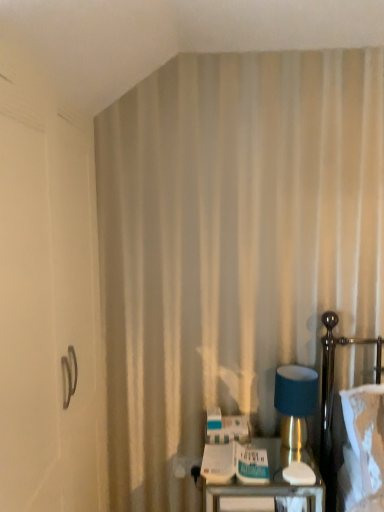
Question: From a real-world perspective, is metallic handle at left on top of matte blue fabric at right?

Choices:
 (A) yes
 (B) no

Answer: (A)

Question: From a real-world perspective, is metallic handle at left beneath matte blue fabric at right?

Choices:
 (A) yes
 (B) no

Answer: (B)

Question: Is metallic handle at left bigger than matte blue fabric at right?

Choices:
 (A) no
 (B) yes

Answer: (B)

Question: Is metallic handle at left thinner than matte blue fabric at right?

Choices:
 (A) yes
 (B) no

Answer: (B)

Question: From the image's perspective, does metallic handle at left appear higher than matte blue fabric at right?

Choices:
 (A) no
 (B) yes

Answer: (B)

Question: Is white fabric bed at right taller or shorter than metallic silver tray at lower right?

Choices:
 (A) short
 (B) tall

Answer: (B)

Question: Would you say white fabric bed at right is to the left or to the right of metallic silver tray at lower right in the picture?

Choices:
 (A) left
 (B) right

Answer: (B)

Question: From the image's perspective, relative to metallic silver tray at lower right, is white fabric bed at right above or below?

Choices:
 (A) below
 (B) above

Answer: (B)

Question: Is point (344, 336) positioned closer to the camera than point (276, 498)?

Choices:
 (A) closer
 (B) farther

Answer: (B)

Question: Is point click(x=231, y=497) positioned closer to the camera than point click(x=322, y=346)?

Choices:
 (A) farther
 (B) closer

Answer: (B)

Question: From a real-world perspective, relative to white fabric bed at right, is metallic silver tray at lower right vertically above or below?

Choices:
 (A) below
 (B) above

Answer: (A)

Question: Based on their sizes in the image, would you say metallic silver tray at lower right is bigger or smaller than white fabric bed at right?

Choices:
 (A) big
 (B) small

Answer: (A)

Question: From the image's perspective, is metallic silver tray at lower right above or below white fabric bed at right?

Choices:
 (A) below
 (B) above

Answer: (A)

Question: Is matte blue fabric at right in front of or behind metallic handle at left in the image?

Choices:
 (A) behind
 (B) front

Answer: (A)

Question: Is matte blue fabric at right wider or thinner than metallic handle at left?

Choices:
 (A) wide
 (B) thin

Answer: (B)